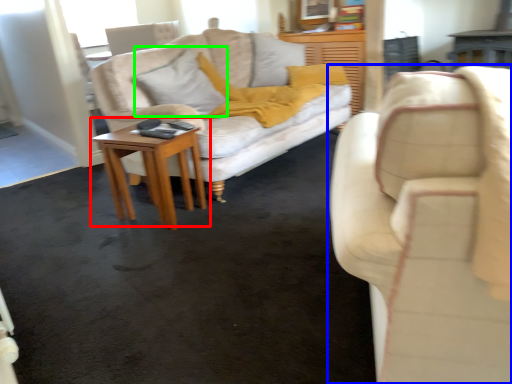
Question: Which is farther away from table (highlighted by a red box)? studio couch (highlighted by a blue box) or pillow (highlighted by a green box)?

Choices:
 (A) studio couch
 (B) pillow

Answer: (A)